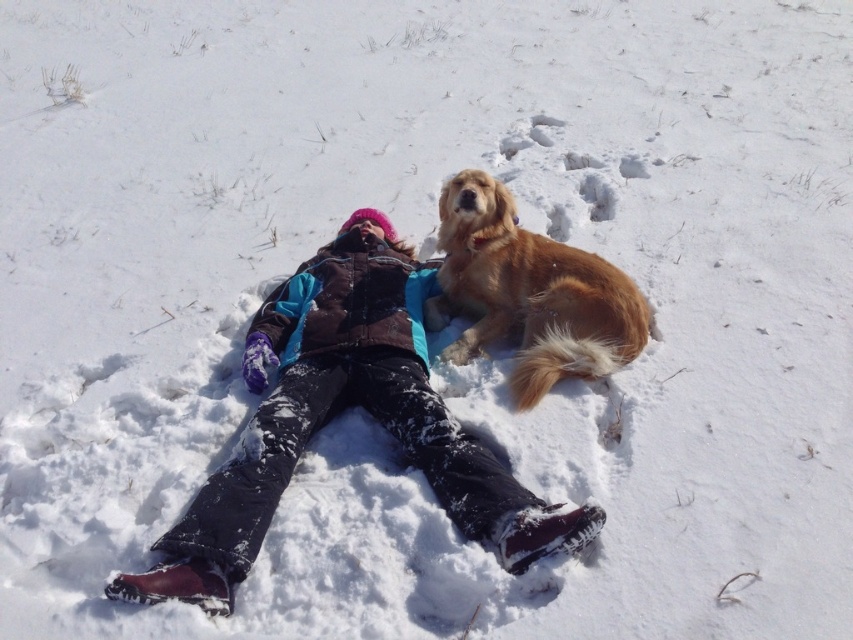
Question: Is velvet brown jacket at center below golden fur dog at upper right?

Choices:
 (A) yes
 (B) no

Answer: (A)

Question: Which point is farther to the camera?

Choices:
 (A) (453, 285)
 (B) (248, 436)

Answer: (A)

Question: Which of the following is the farthest from the observer?

Choices:
 (A) (367, 296)
 (B) (466, 243)

Answer: (B)

Question: Can you confirm if velvet brown jacket at center is positioned to the left of golden fur dog at upper right?

Choices:
 (A) no
 (B) yes

Answer: (B)

Question: Which point is farther to the camera?

Choices:
 (A) golden fur dog at upper right
 (B) velvet brown jacket at center

Answer: (A)

Question: Is velvet brown jacket at center to the left of golden fur dog at upper right from the viewer's perspective?

Choices:
 (A) yes
 (B) no

Answer: (A)